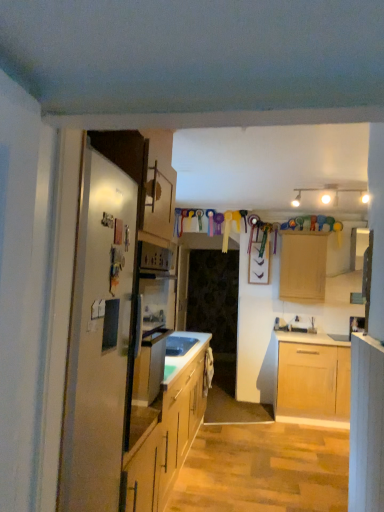
Question: Is satin silver refrigerator at left at the left side of transparent glass door at center?

Choices:
 (A) yes
 (B) no

Answer: (A)

Question: Is satin silver refrigerator at left outside transparent glass door at center?

Choices:
 (A) yes
 (B) no

Answer: (A)

Question: Is satin silver refrigerator at left turned away from transparent glass door at center?

Choices:
 (A) no
 (B) yes

Answer: (A)

Question: From a real-world perspective, is satin silver refrigerator at left under transparent glass door at center?

Choices:
 (A) yes
 (B) no

Answer: (B)

Question: From the image's perspective, is satin silver refrigerator at left below transparent glass door at center?

Choices:
 (A) no
 (B) yes

Answer: (A)

Question: Is point (173, 337) closer or farther from the camera than point (178, 310)?

Choices:
 (A) closer
 (B) farther

Answer: (A)

Question: Is white glossy sink at center situated inside transparent glass door at center or outside?

Choices:
 (A) outside
 (B) inside

Answer: (A)

Question: Is white glossy sink at center taller or shorter than transparent glass door at center?

Choices:
 (A) short
 (B) tall

Answer: (A)

Question: Looking at the image, does white glossy sink at center seem bigger or smaller compared to transparent glass door at center?

Choices:
 (A) small
 (B) big

Answer: (A)

Question: Looking at their shapes, would you say transparent glass door at center is wider or thinner than light wood cabinet at upper center, which appears as the second cabinetry when viewed from the left?

Choices:
 (A) wide
 (B) thin

Answer: (B)

Question: From the image's perspective, is transparent glass door at center above or below light wood cabinet at upper center, the second cabinetry viewed from the front?

Choices:
 (A) above
 (B) below

Answer: (B)

Question: Is transparent glass door at center inside or outside of light wood cabinet at upper center, which appears as the second cabinetry when viewed from the left?

Choices:
 (A) inside
 (B) outside

Answer: (B)

Question: In the image, is transparent glass door at center positioned in front of or behind light wood cabinet at upper center, the second cabinetry viewed from the front?

Choices:
 (A) front
 (B) behind

Answer: (B)

Question: In the image, is white glossy sink at center positioned in front of or behind satin silver refrigerator at left?

Choices:
 (A) front
 (B) behind

Answer: (B)

Question: From the image's perspective, is white glossy sink at center above or below satin silver refrigerator at left?

Choices:
 (A) below
 (B) above

Answer: (A)